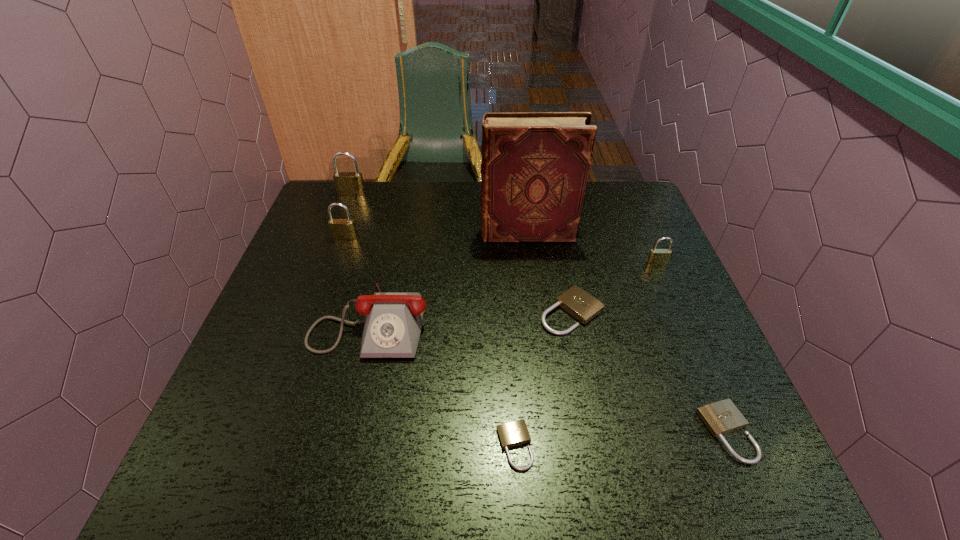
Find the location of a particular element. vacant space located on the front-facing side of the fifth nearest object is located at coordinates (689, 340).

I want to click on vacant area located 0.200m on the back of the second beige padlock from left to right, so click(557, 240).

Find the location of a particular element. The image size is (960, 540). free space located on the back of the second biggest beige padlock is located at coordinates (689, 343).

At what (x,y) coordinates should I click in order to perform the action: click on free space located on the right of the leftmost beige padlock. Please return your answer as a coordinate pair (x, y). Image resolution: width=960 pixels, height=540 pixels. Looking at the image, I should click on (575, 446).

The width and height of the screenshot is (960, 540). Find the location of `hardback book located at the far edge`. hardback book located at the far edge is located at coordinates (535, 165).

Where is `padlock located in the far edge section of the desktop`? Image resolution: width=960 pixels, height=540 pixels. padlock located in the far edge section of the desktop is located at coordinates (350, 184).

Where is `telephone that is at the left edge`? The height and width of the screenshot is (540, 960). telephone that is at the left edge is located at coordinates (393, 324).

Identify the location of object positioned at the far left corner. The width and height of the screenshot is (960, 540). (350, 184).

Find the location of `object that is at the near right corner`. object that is at the near right corner is located at coordinates (721, 417).

This screenshot has width=960, height=540. Find the location of `free spot at the far edge of the desktop`. free spot at the far edge of the desktop is located at coordinates (420, 220).